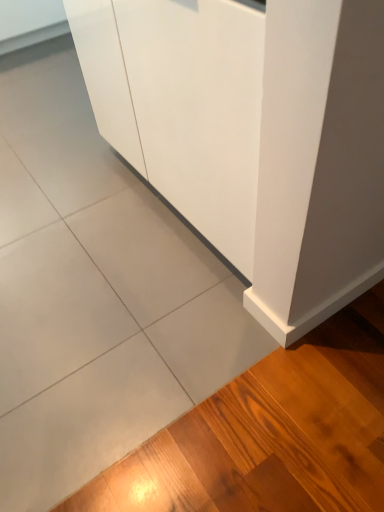
Locate an element on the screen. This screenshot has height=512, width=384. white glossy cabinet at center is located at coordinates (253, 135).

In order to face white glossy cabinet at center, should I rotate leftwards or rightwards?

To face it directly, rotate left by 12.021 degrees.

This screenshot has height=512, width=384. What do you see at coordinates (253, 135) in the screenshot? I see `white glossy cabinet at center` at bounding box center [253, 135].

Locate an element on the screen. This screenshot has width=384, height=512. white glossy cabinet at center is located at coordinates (253, 135).